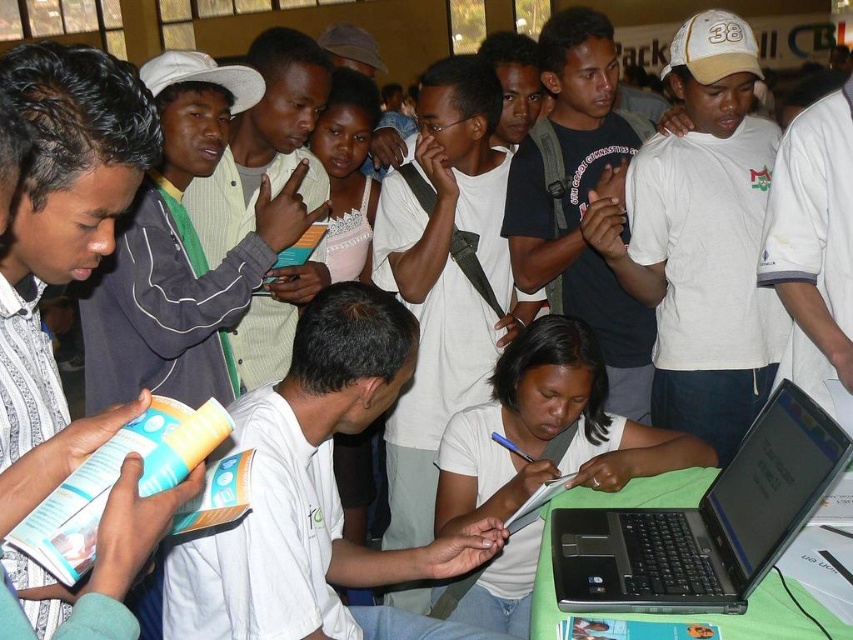
Question: In this image, where is black plastic laptop at lower right located relative to white matte shirt at center?

Choices:
 (A) right
 (B) left

Answer: (A)

Question: Considering the relative positions of black plastic laptop at lower right and white matte shirt at center in the image provided, where is black plastic laptop at lower right located with respect to white matte shirt at center?

Choices:
 (A) above
 (B) below

Answer: (A)

Question: Which object appears farthest from the camera in this image?

Choices:
 (A) black plastic laptop at lower right
 (B) white matte shirt at center

Answer: (B)

Question: Can you confirm if black plastic laptop at lower right is thinner than white matte shirt at center?

Choices:
 (A) yes
 (B) no

Answer: (A)